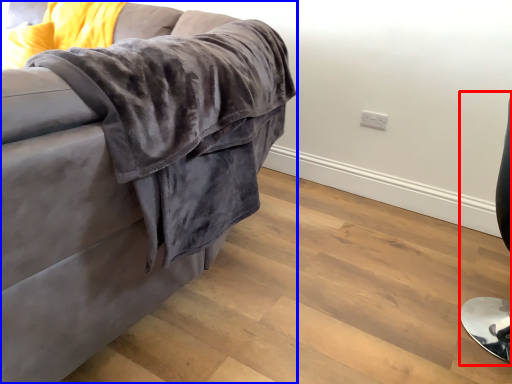
Question: Which object is further to the camera taking this photo, computer chair (highlighted by a red box) or studio couch (highlighted by a blue box)?

Choices:
 (A) computer chair
 (B) studio couch

Answer: (A)